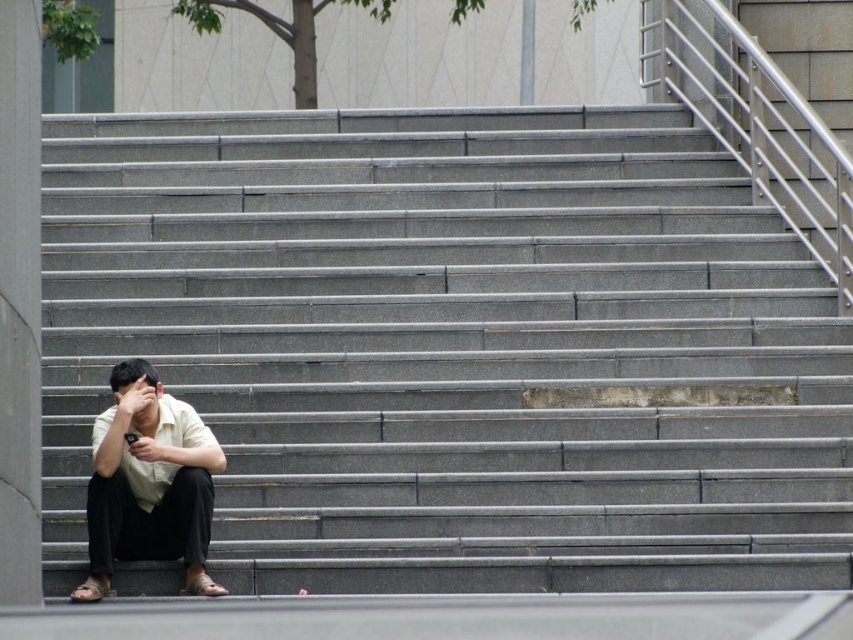
Question: Is white matte shirt at lower left behind matte black hand at lower left?

Choices:
 (A) no
 (B) yes

Answer: (A)

Question: Which object appears farthest from the camera in this image?

Choices:
 (A) matte black hand at lower left
 (B) gray concrete stairs at lower left

Answer: (A)

Question: Does white matte shirt at lower left lie in front of matte black hand at lower left?

Choices:
 (A) yes
 (B) no

Answer: (A)

Question: Is white matte shirt at lower left above white matte hand at lower left?

Choices:
 (A) no
 (B) yes

Answer: (A)

Question: Based on their relative distances, which object is nearer to the white matte hand at lower left?

Choices:
 (A) white matte shirt at lower left
 (B) matte black hand at lower left
 (C) gray concrete stairs at lower left

Answer: (B)

Question: Which of the following is the farthest from the observer?

Choices:
 (A) (117, 403)
 (B) (132, 456)
 (C) (45, 260)

Answer: (C)